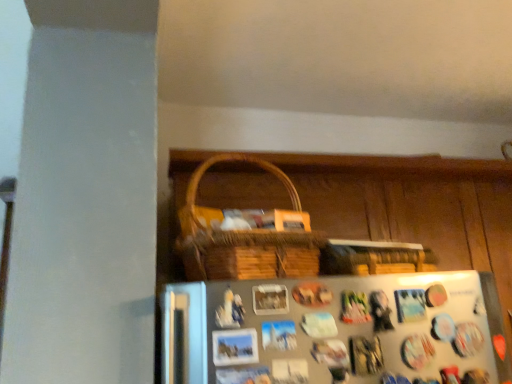
Question: Can you confirm if woven wood basket at upper center is wider than metallic silver fridge at lower center?

Choices:
 (A) yes
 (B) no

Answer: (A)

Question: Is woven wood basket at upper center further to camera compared to metallic silver fridge at lower center?

Choices:
 (A) no
 (B) yes

Answer: (B)

Question: Are woven wood basket at upper center and metallic silver fridge at lower center beside each other?

Choices:
 (A) no
 (B) yes

Answer: (A)

Question: From a real-world perspective, is woven wood basket at upper center positioned over metallic silver fridge at lower center based on gravity?

Choices:
 (A) no
 (B) yes

Answer: (B)

Question: Is metallic silver fridge at lower center inside woven wood basket at upper center?

Choices:
 (A) yes
 (B) no

Answer: (B)

Question: Can you confirm if woven wood basket at upper center is positioned to the right of metallic silver fridge at lower center?

Choices:
 (A) no
 (B) yes

Answer: (B)

Question: Is metallic silver fridge at lower center bigger than woven wood basket at upper center?

Choices:
 (A) yes
 (B) no

Answer: (B)

Question: Is metallic silver fridge at lower center thinner than woven wood basket at upper center?

Choices:
 (A) yes
 (B) no

Answer: (A)

Question: Is metallic silver fridge at lower center surrounding woven wood basket at upper center?

Choices:
 (A) yes
 (B) no

Answer: (B)

Question: Is metallic silver fridge at lower center smaller than woven wood basket at upper center?

Choices:
 (A) no
 (B) yes

Answer: (B)

Question: Does metallic silver fridge at lower center have a greater height compared to woven wood basket at upper center?

Choices:
 (A) no
 (B) yes

Answer: (A)

Question: Can you confirm if metallic silver fridge at lower center is positioned to the right of woven wood basket at upper center?

Choices:
 (A) no
 (B) yes

Answer: (A)

Question: In the image, is metallic silver fridge at lower center positioned in front of or behind woven wood basket at upper center?

Choices:
 (A) behind
 (B) front

Answer: (B)